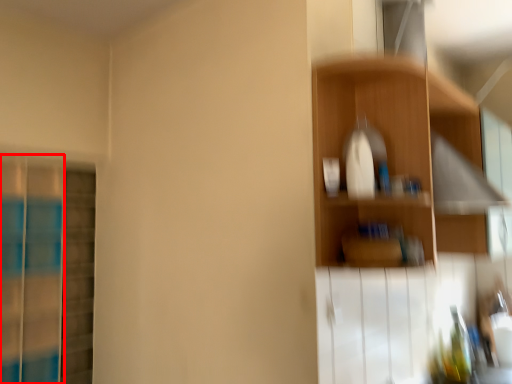
Question: From the image's perspective, what is the correct spatial positioning of screen door (annotated by the red box) in reference to shelf?

Choices:
 (A) below
 (B) above

Answer: (A)